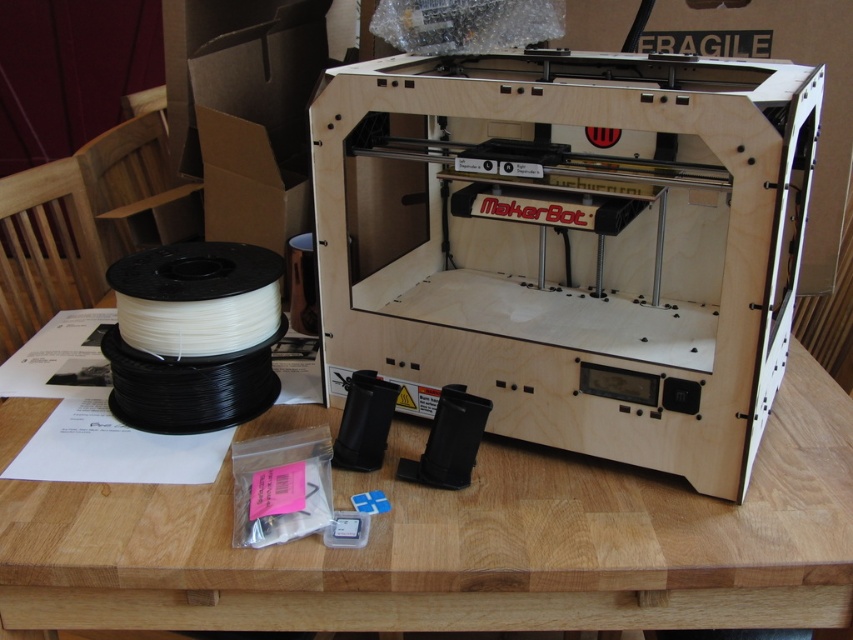
You are a technician who needs to place a tool that measures 12 inches in length between the wooden table at center and the white matte filament at lower left. Will the tool fit in the space between them?

The distance between the wooden table at center and the white matte filament at lower left is 11.92 inches. Since the tool is 12 inches long, it will not fit in the space between them as the tool is slightly longer than the available distance.

You are standing in front of the MakerBot 3D printer on the wooden table. You see two points marked as point (64, 570) and point (170, 323). Which point is closer to you?

Point (64, 570) is in front of point (170, 323), so it is closer to you.

In the scene shown: You are setting up a MakerBot 3D printer and need to place the white matte filament at lower left onto the wooden table at center. Can the filament be placed on the table without needing to adjust the table height?

The wooden table at center is taller than the white matte filament at lower left, so yes, the filament can be placed on the table without needing to adjust the table height.